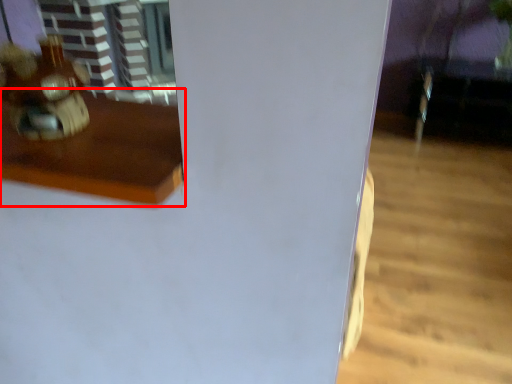
Question: From the image's perspective, where is furniture (annotated by the red box) located relative to toy?

Choices:
 (A) below
 (B) above

Answer: (A)